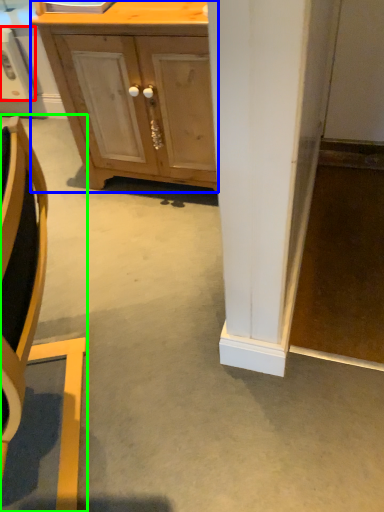
Question: Which object is the farthest from appliance (highlighted by a red box)? Choose among these: cabinetry (highlighted by a blue box) or chair (highlighted by a green box).

Choices:
 (A) cabinetry
 (B) chair

Answer: (B)